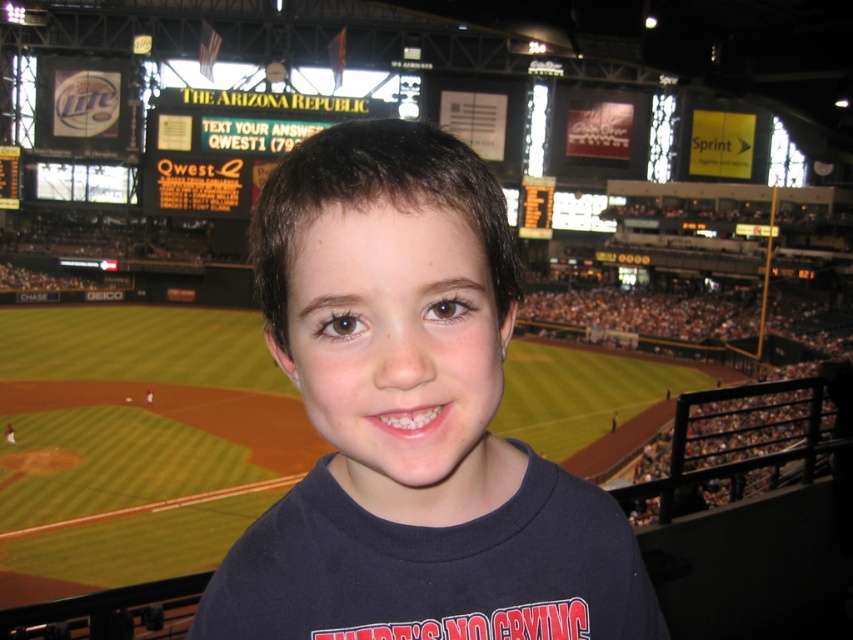
Question: Can you confirm if dark blue t-shirt at center is bigger than yellow digital scoreboard at upper center?

Choices:
 (A) no
 (B) yes

Answer: (A)

Question: In this image, where is dark blue t-shirt at center located relative to yellow digital scoreboard at upper center?

Choices:
 (A) below
 (B) above

Answer: (A)

Question: Which object is farther from the camera taking this photo?

Choices:
 (A) yellow digital scoreboard at upper center
 (B) dark blue t-shirt at center

Answer: (A)

Question: Is dark blue t-shirt at center positioned before yellow digital scoreboard at upper center?

Choices:
 (A) yes
 (B) no

Answer: (A)